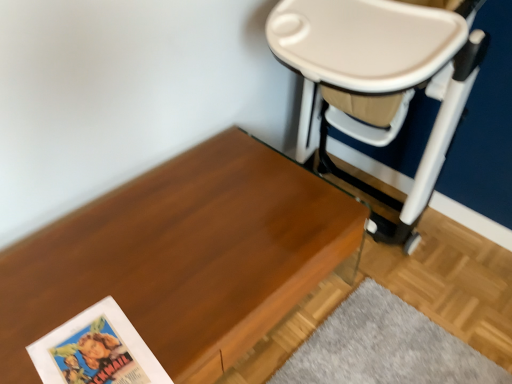
Where is `blank space situated above wooden table at lower left (from a real-world perspective)`? The height and width of the screenshot is (384, 512). blank space situated above wooden table at lower left (from a real-world perspective) is located at coordinates (169, 255).